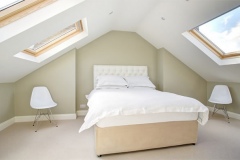
Where is `baseboard`? The height and width of the screenshot is (160, 240). baseboard is located at coordinates click(x=234, y=118), click(x=63, y=116), click(x=81, y=111), click(x=12, y=129).